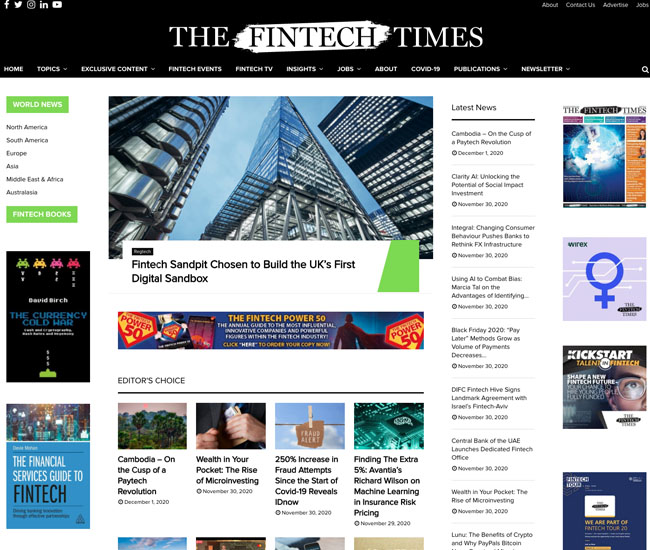
The height and width of the screenshot is (550, 650). Find the location of `book covers`. book covers is located at coordinates (47, 315), (42, 478).